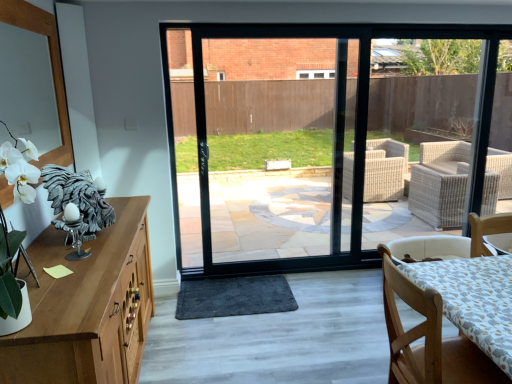
Question: Would you say dark gray plush mat at center is to the left or to the right of wooden chair at lower right in the picture?

Choices:
 (A) right
 (B) left

Answer: (B)

Question: From a real-world perspective, is dark gray plush mat at center above or below wooden chair at lower right?

Choices:
 (A) above
 (B) below

Answer: (B)

Question: Considering the positions of dark gray plush mat at center and wooden chair at lower right in the image, is dark gray plush mat at center wider or thinner than wooden chair at lower right?

Choices:
 (A) wide
 (B) thin

Answer: (A)

Question: Considering the positions of wooden chair at lower right and dark gray plush mat at center in the image, is wooden chair at lower right taller or shorter than dark gray plush mat at center?

Choices:
 (A) tall
 (B) short

Answer: (A)

Question: In the image, is wooden chair at lower right on the left side or the right side of dark gray plush mat at center?

Choices:
 (A) left
 (B) right

Answer: (B)

Question: Do you think wooden chair at lower right is within dark gray plush mat at center, or outside of it?

Choices:
 (A) outside
 (B) inside

Answer: (A)

Question: From a real-world perspective, relative to dark gray plush mat at center, is wooden chair at lower right vertically above or below?

Choices:
 (A) above
 (B) below

Answer: (A)